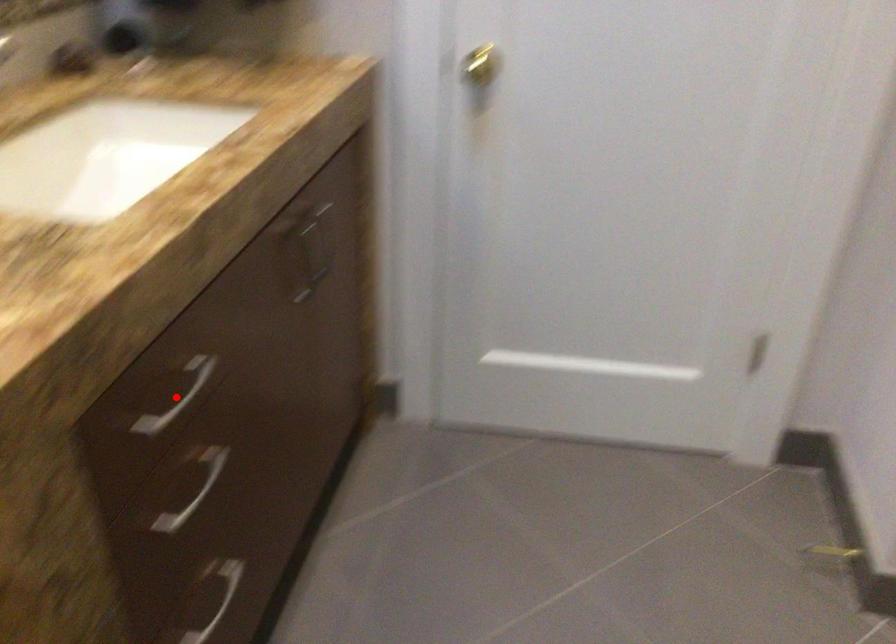
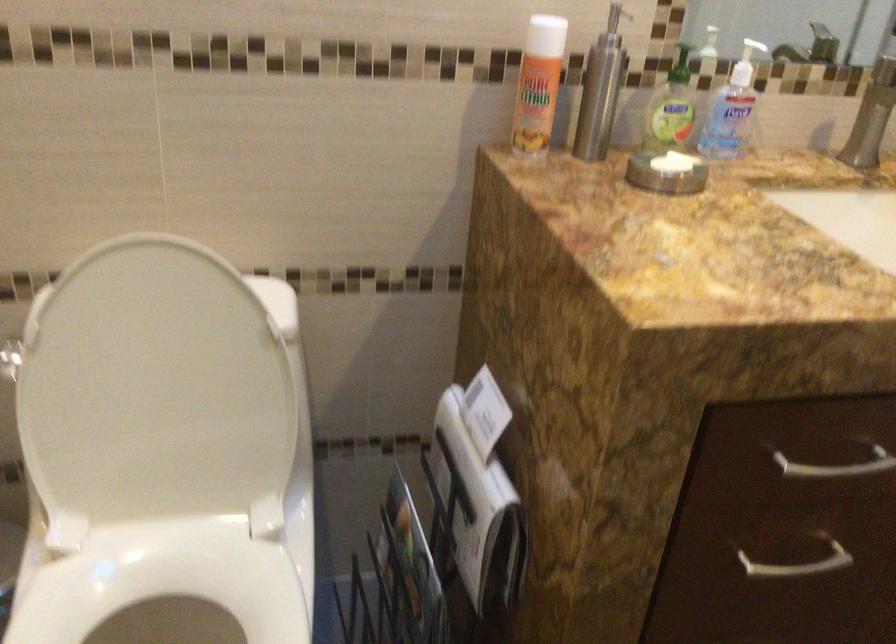
Find the pixel in the second image that matches the highlighted location in the first image.

(837, 466)